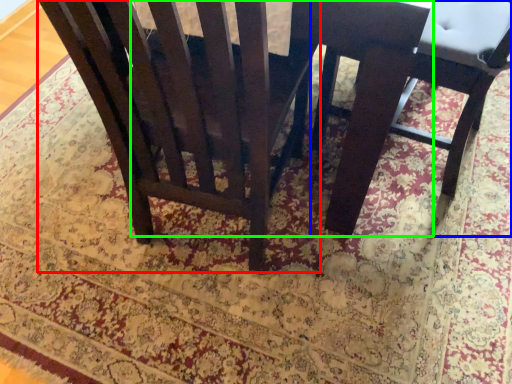
Question: Estimate the real-world distances between objects in this image. Which object is farther from chair (highlighted by a red box), chair (highlighted by a blue box) or round table (highlighted by a green box)?

Choices:
 (A) chair
 (B) round table

Answer: (A)